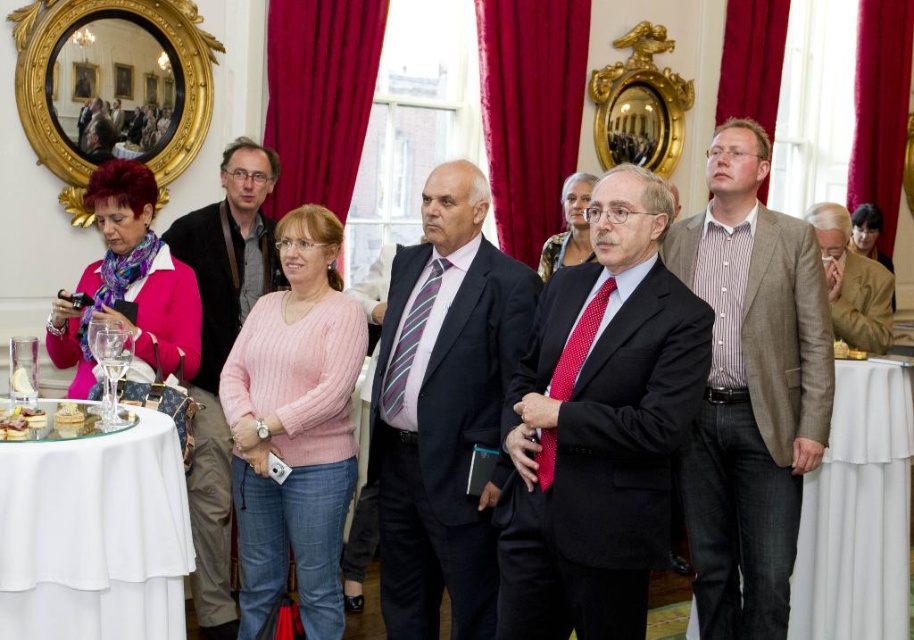
Question: Does striped cotton shirt at center lie in front of white cloth-covered table at lower left?

Choices:
 (A) no
 (B) yes

Answer: (A)

Question: Which point is farther to the camera?

Choices:
 (A) white cloth at lower right
 (B) dark blue suit at center
 (C) matte black jacket at center
 (D) white cloth-covered table at lower left

Answer: (A)

Question: Which point appears farthest from the camera in this image?

Choices:
 (A) (413, 300)
 (B) (72, 417)
 (C) (696, 500)
 (D) (73, 68)

Answer: (D)

Question: Can you confirm if matte black jacket at center is positioned to the left of goldwooden frame at upper left?

Choices:
 (A) yes
 (B) no

Answer: (B)

Question: Which point is farther to the camera?

Choices:
 (A) (121, 4)
 (B) (73, 77)
 (C) (870, 504)

Answer: (A)

Question: Does dark blue suit at center have a greater width compared to matte black jacket at center?

Choices:
 (A) no
 (B) yes

Answer: (B)